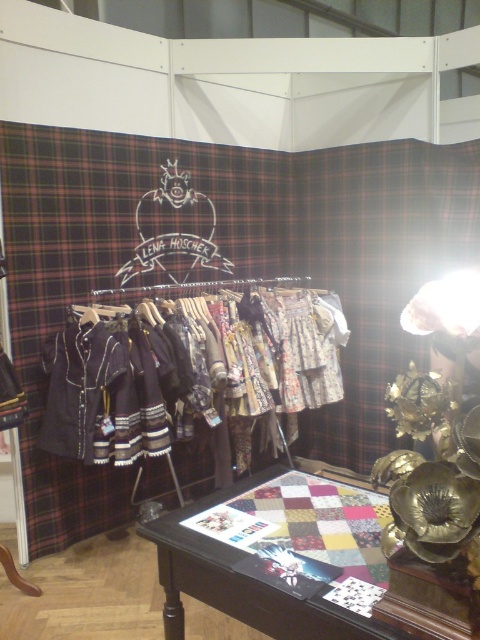
You are standing in front of the display setup and want to touch both the point at coordinates point [101,428] and point [337,529]. Which point should you reach for first to touch the closer one?

You should reach for point [101,428] first because it is closer to you than point [337,529].

You are a fashion designer standing at the entrance of the booth. You need to retrieve a jacket from the textured woolen jackets at center to show to a client. However, there is a rack of garments on your left blocking your path. Can you reach the jackets without moving the rack?

The textured woolen jackets at center is located at point (187, 371), which is likely within reach without needing to move the rack of garments on the left, as coordinates suggest it is positioned centrally in the booth.

You are a fashion designer standing at the edge of the booth and want to reach both the textured woolen jackets at center and the wooden quilted table at center. Which object is closer to you?

The distance between the textured woolen jackets at center and the wooden quilted table at center is 1.24 meters, so they are both at the same distance from you since they are positioned at the center of the image.